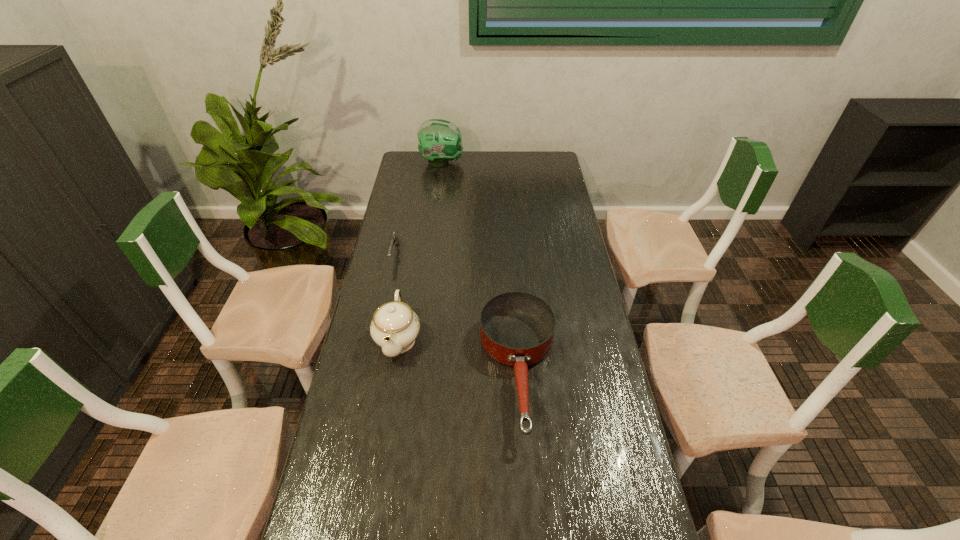
Select which object appears as the closest to the football helmet. Please provide its 2D coordinates. Your answer should be formatted as a tuple, i.e. [(x, y)], where the tuple contains the x and y coordinates of a point satisfying the conditions above.

[(394, 239)]

Identify the location of free location that satisfies the following two spatial constraints: 1. on the visor of the tallest object; 2. aiming along the barrel of the shortest object. This screenshot has width=960, height=540. (430, 254).

You are a GUI agent. You are given a task and a screenshot of the screen. Output one action in this format:
    pyautogui.click(x=<x>, y=<y>)
    Task: Click on the vacant position in the image that satisfies the following two spatial constraints: 1. on the visor of the farthest object; 2. aiming along the barrel of the gun
    Image resolution: width=960 pixels, height=540 pixels.
    Given the screenshot: What is the action you would take?
    pyautogui.click(x=430, y=254)

The height and width of the screenshot is (540, 960). I want to click on free location that satisfies the following two spatial constraints: 1. on the visor of the farthest object; 2. aiming along the barrel of the second farthest object, so click(x=430, y=254).

You are a GUI agent. You are given a task and a screenshot of the screen. Output one action in this format:
    pyautogui.click(x=<x>, y=<y>)
    Task: Click on the free point that satisfies the following two spatial constraints: 1. on the visor of the football helmet; 2. at the spout of the second tallest object
    Image resolution: width=960 pixels, height=540 pixels.
    Given the screenshot: What is the action you would take?
    pyautogui.click(x=420, y=339)

Find the location of `vacant position in the image that satisfies the following two spatial constraints: 1. on the visor of the football helmet; 2. at the spout of the chinaware`. vacant position in the image that satisfies the following two spatial constraints: 1. on the visor of the football helmet; 2. at the spout of the chinaware is located at coordinates (420, 339).

You are a GUI agent. You are given a task and a screenshot of the screen. Output one action in this format:
    pyautogui.click(x=<x>, y=<y>)
    Task: Click on the vacant region that satisfies the following two spatial constraints: 1. on the visor of the football helmet; 2. aiming along the barrel of the gun
    This screenshot has width=960, height=540.
    Given the screenshot: What is the action you would take?
    pyautogui.click(x=430, y=254)

The height and width of the screenshot is (540, 960). I want to click on blank space that satisfies the following two spatial constraints: 1. on the visor of the farthest object; 2. at the spout of the second tallest object, so click(x=420, y=339).